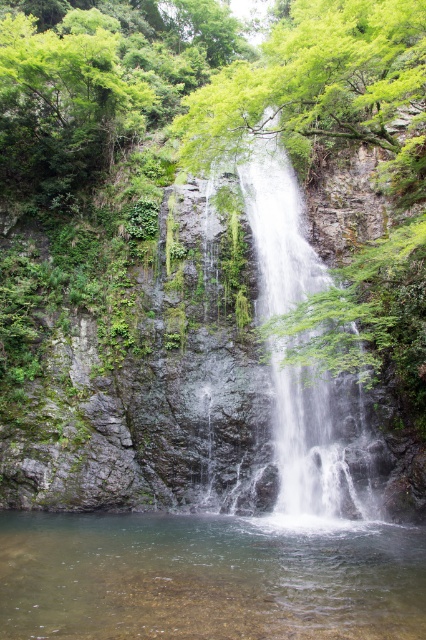
Is clear water at bottom smaller than clear water at center?

Correct, clear water at bottom occupies less space than clear water at center.

Which is behind, point (149, 579) or point (299, 492)?

The point (299, 492) is behind.

You are a GUI agent. You are given a task and a screenshot of the screen. Output one action in this format:
    pyautogui.click(x=<x>, y=<y>)
    Task: Click on the clear water at bottom
    This screenshot has height=640, width=426.
    Given the screenshot: What is the action you would take?
    pyautogui.click(x=207, y=579)